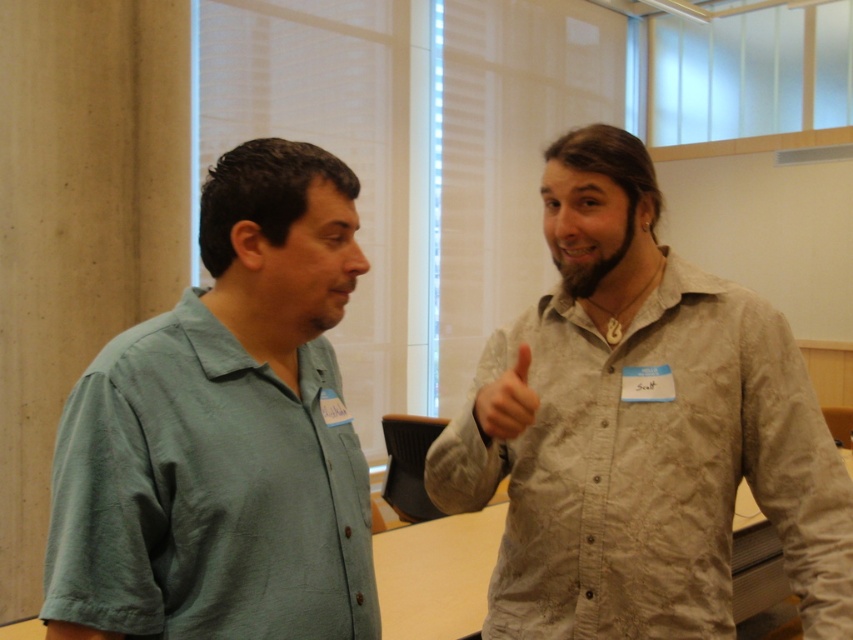
Question: Estimate the real-world distances between objects in this image. Which object is closer to the light brown textured shirt at upper right?

Choices:
 (A) matte skin hand at upper right
 (B) green cotton shirt at left

Answer: (A)

Question: Does green cotton shirt at left have a greater width compared to matte skin hand at upper right?

Choices:
 (A) no
 (B) yes

Answer: (B)

Question: Can you confirm if light brown textured shirt at upper right is positioned to the left of green cotton shirt at left?

Choices:
 (A) no
 (B) yes

Answer: (A)

Question: Which point is farther from the camera taking this photo?

Choices:
 (A) (497, 420)
 (B) (196, 560)

Answer: (A)

Question: Is light brown textured shirt at upper right above matte skin hand at upper right?

Choices:
 (A) yes
 (B) no

Answer: (B)

Question: Estimate the real-world distances between objects in this image. Which object is farther from the green cotton shirt at left?

Choices:
 (A) light brown textured shirt at upper right
 (B) matte skin hand at upper right

Answer: (A)